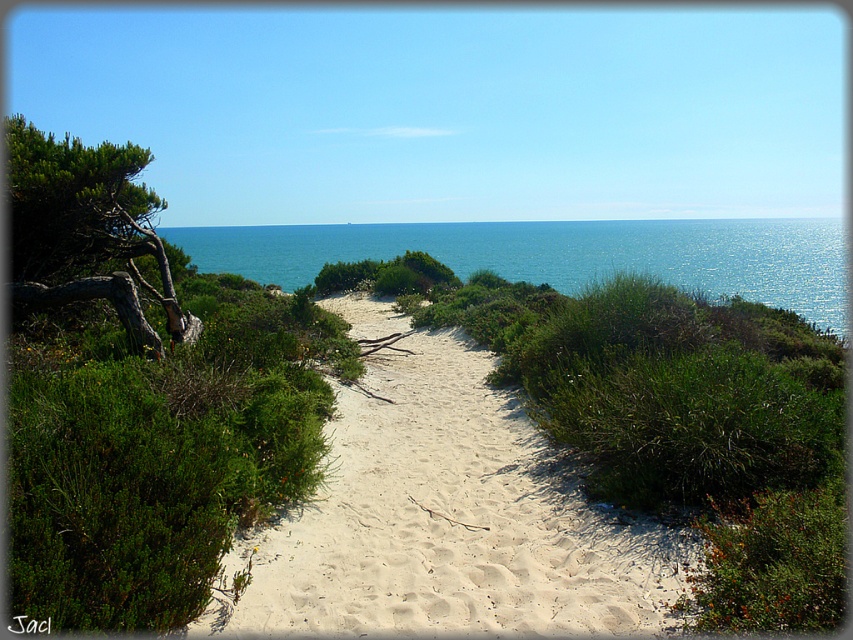
Can you confirm if white sandy path at center is positioned below blue water at upper center?

Yes, white sandy path at center is below blue water at upper center.

Does white sandy path at center lie in front of blue water at upper center?

Yes.

Locate an element on the screen. The width and height of the screenshot is (853, 640). white sandy path at center is located at coordinates (445, 516).

Between point (766, 301) and point (16, 196), which one is positioned behind?

Point (766, 301)

Does blue water at upper center appear over green rough bark tree at left?

Indeed, blue water at upper center is positioned over green rough bark tree at left.

Who is more forward, (508, 246) or (44, 304)?

Point (44, 304) is more forward.

Find the location of `blue water at upper center`. blue water at upper center is located at coordinates (563, 253).

Is white sandy path at center shorter than green rough bark tree at left?

Yes, white sandy path at center is shorter than green rough bark tree at left.

Can you confirm if white sandy path at center is positioned to the right of green rough bark tree at left?

Yes, white sandy path at center is to the right of green rough bark tree at left.

Image resolution: width=853 pixels, height=640 pixels. What are the coordinates of `white sandy path at center` in the screenshot? It's located at coord(445,516).

This screenshot has height=640, width=853. Identify the location of white sandy path at center. (445, 516).